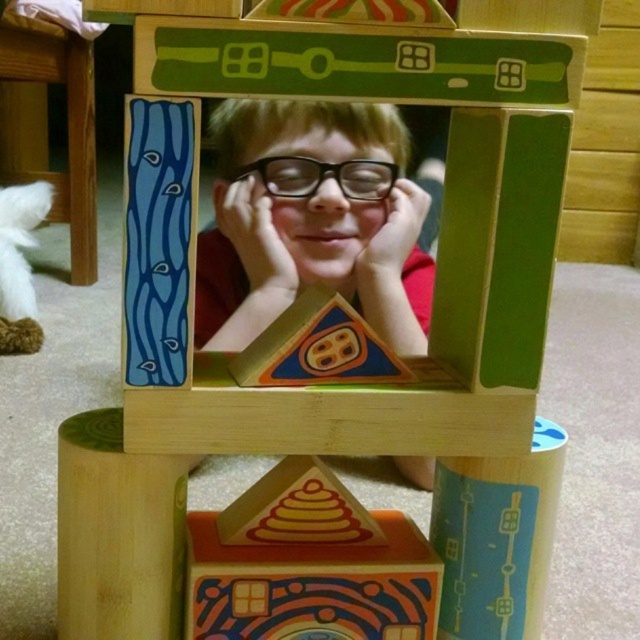
Question: Is matte black glasses at center behind wooden stool at lower left?

Choices:
 (A) no
 (B) yes

Answer: (A)

Question: Considering the relative positions of matte black glasses at center and wooden stool at lower left in the image provided, where is matte black glasses at center located with respect to wooden stool at lower left?

Choices:
 (A) left
 (B) right

Answer: (B)

Question: Among these objects, which one is farthest from the camera?

Choices:
 (A) matte black glasses at center
 (B) wooden stool at lower left

Answer: (B)

Question: Which point is farther to the camera?

Choices:
 (A) (76, 211)
 (B) (384, 125)

Answer: (A)

Question: Which object appears farthest from the camera in this image?

Choices:
 (A) matte black glasses at center
 (B) wooden stool at lower left

Answer: (B)

Question: Is matte black glasses at center to the right of wooden stool at lower left from the viewer's perspective?

Choices:
 (A) yes
 (B) no

Answer: (A)